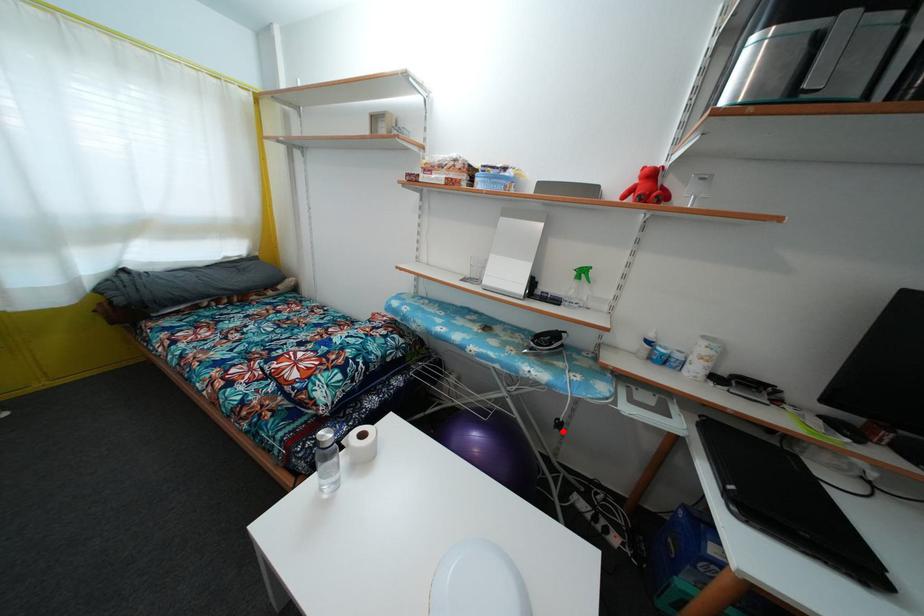
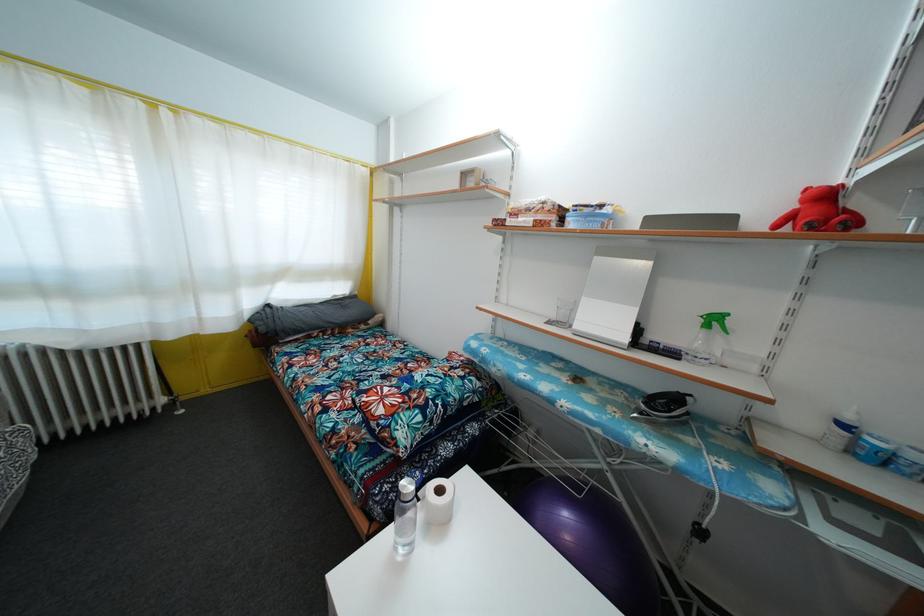
Question: I am providing you with two images of the same scene from different viewpoints. In image1, a red point is highlighted. Considering the same 3D point in image2, which of the following is correct?

Choices:
 (A) It is closer
 (B) It is farther

Answer: (B)